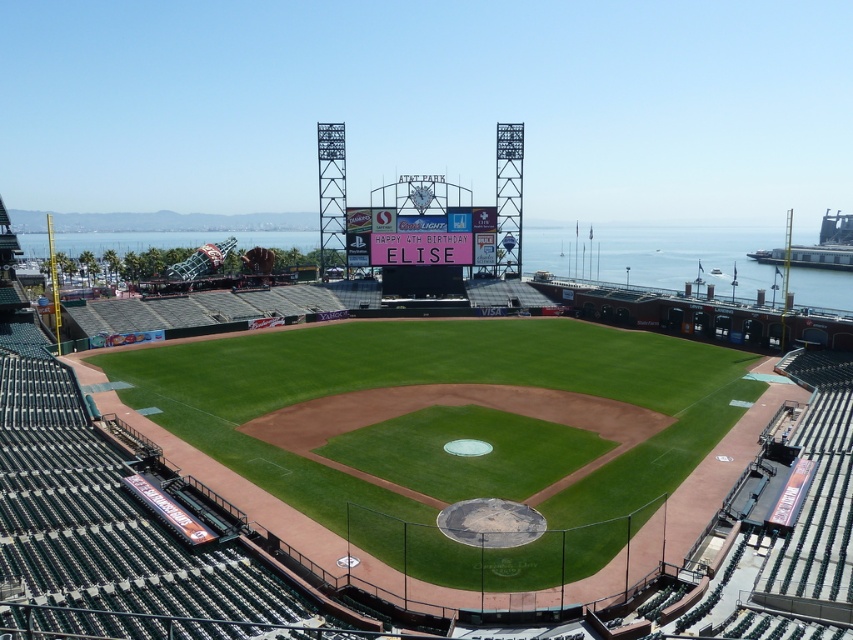
You are standing at the entrance of AT T Park and want to find the green grass baseball stadium at center. According to the coordinates provided, in which direction should you walk to reach it?

The green grass baseball stadium at center is located at point (105, 525). Since coordinates typically represent x and y axes where higher x values move right and higher y values move down, you should walk towards the right and slightly downward from your current position at the entrance to reach it.

You are a photographer at AT T Park and want to capture both the green grass baseball stadium at center and the pink fabric sign at center in a single shot. Based on their positions, which object should you focus on first to ensure both are in frame?

The green grass baseball stadium at center is to the left of the pink fabric sign at center, so you should focus on the pink fabric sign at center first to ensure both are in frame.

You are a photographer positioned at the back of the stadium, aiming to capture both the transparent glass water at center and the pink fabric sign at center in a single shot. Which object will appear wider in your photo?

The transparent glass water at center will appear wider in the photo because its width is larger than that of the pink fabric sign at center.